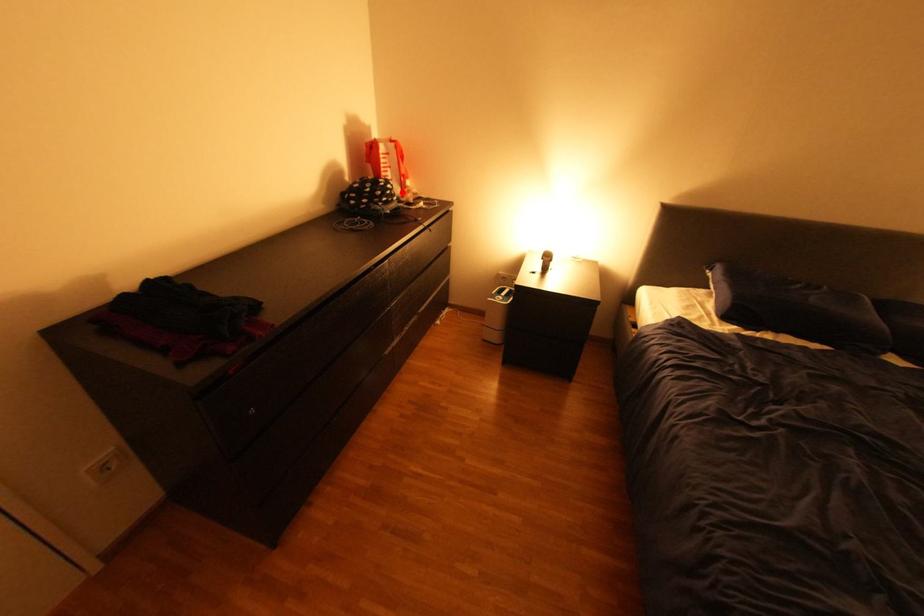
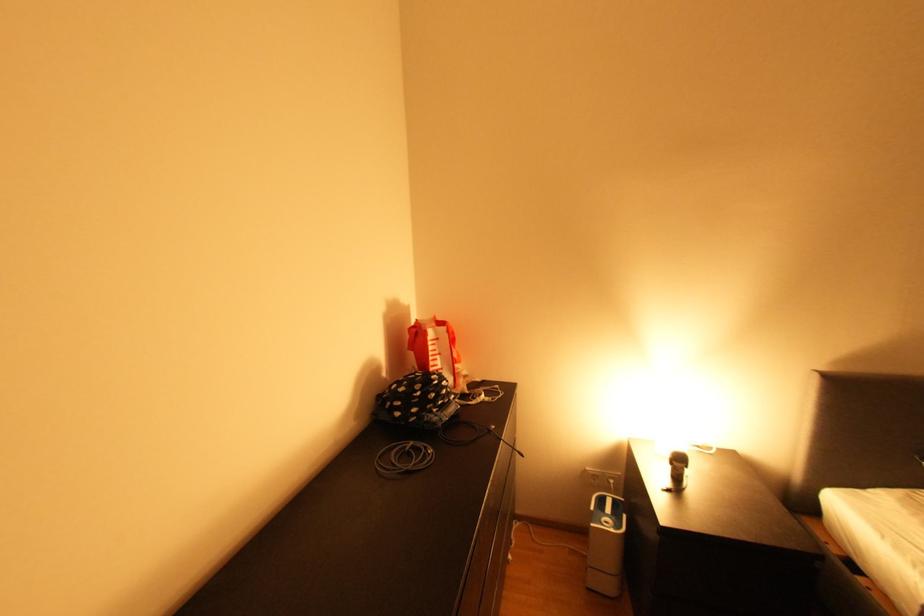
In the second image, find the point that corresponds to the highlighted location in the first image.

(457, 389)